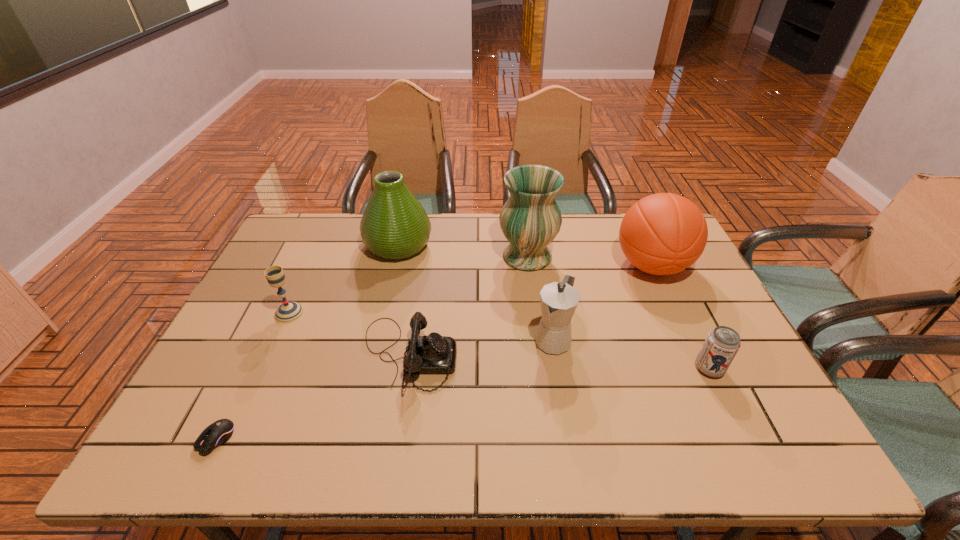
Locate an element on the screen. The image size is (960, 540). computer mouse that is at the left edge is located at coordinates (219, 432).

The height and width of the screenshot is (540, 960). I want to click on basketball that is at the right edge, so click(x=662, y=234).

The image size is (960, 540). What are the coordinates of `beer can positioned at the right edge` in the screenshot? It's located at (722, 343).

Locate an element on the screen. The image size is (960, 540). object that is positioned at the near left corner is located at coordinates (219, 432).

Locate an element on the screen. The image size is (960, 540). object that is at the far right corner is located at coordinates (662, 234).

What are the coordinates of `vacant space at the far edge of the desktop` in the screenshot? It's located at (593, 222).

Find the location of `vacant space at the near edge of the desktop`. vacant space at the near edge of the desktop is located at coordinates (354, 427).

Locate an element on the screen. The width and height of the screenshot is (960, 540). vacant space at the left edge of the desktop is located at coordinates (208, 363).

Locate an element on the screen. The height and width of the screenshot is (540, 960). free region at the right edge of the desktop is located at coordinates (663, 297).

Image resolution: width=960 pixels, height=540 pixels. I want to click on vacant space at the far left corner, so click(335, 214).